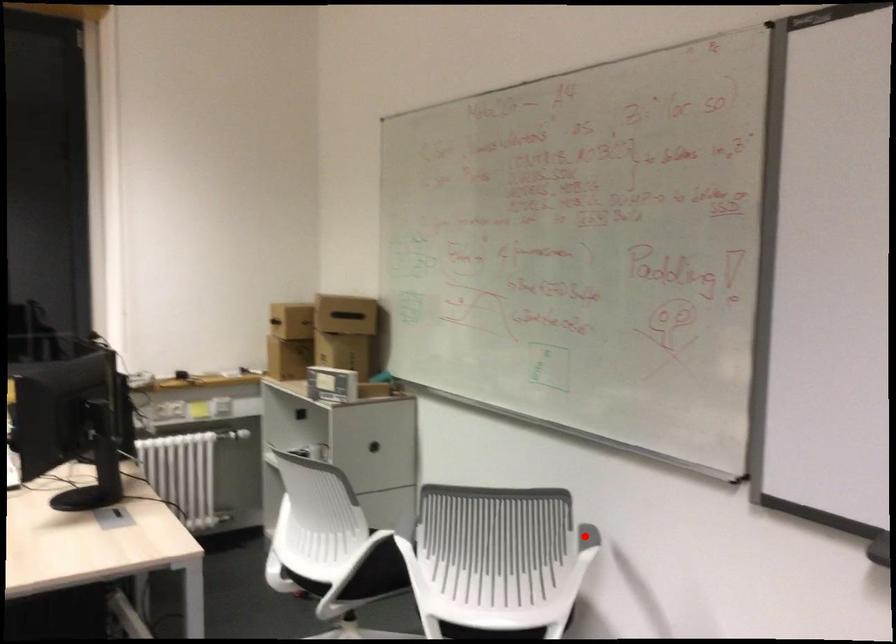
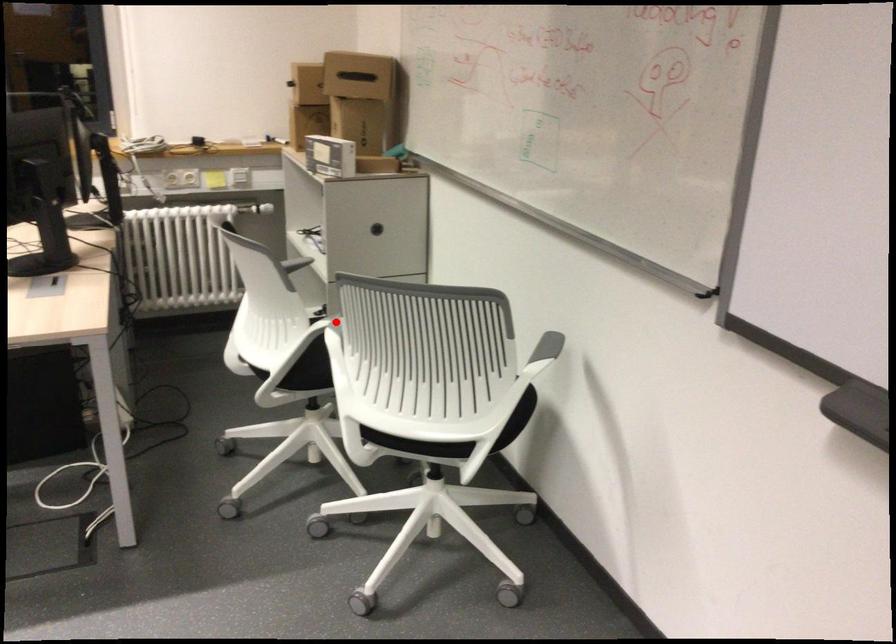
I am providing you with two images of the same scene from different viewpoints. A red point is marked on the first image and another point is marked on the second image. Do the highlighted points in image1 and image2 indicate the same real-world spot?

No